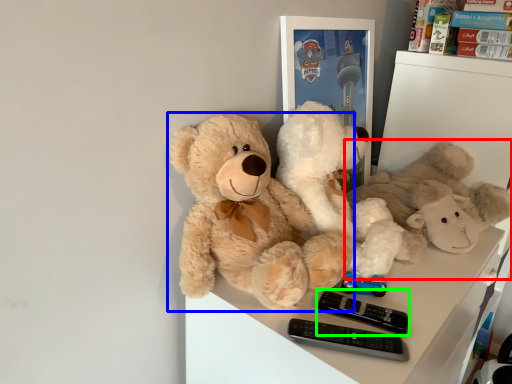
Question: Based on their relative distances, which object is farther from teddy bear (highlighted by a red box)? Choose from teddy bear (highlighted by a blue box) and control (highlighted by a green box).

Choices:
 (A) teddy bear
 (B) control

Answer: (B)